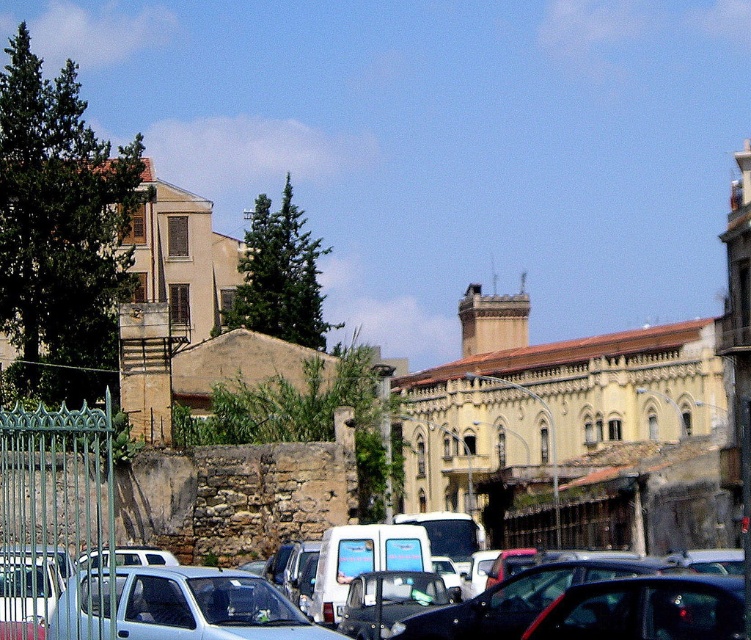
Question: Which object is closer to the camera taking this photo?

Choices:
 (A) light blue matte car at center
 (B) green wrought iron fence at left

Answer: (B)

Question: Estimate the real-world distances between objects in this image. Which object is closer to the green wrought iron fence at left?

Choices:
 (A) metallic silver car at center
 (B) light blue matte car at center

Answer: (B)

Question: Which is farther from the green wrought iron fence at left?

Choices:
 (A) metallic silver car at center
 (B) light blue matte car at center

Answer: (A)

Question: Can you confirm if metallic silver car at center is positioned below green wrought iron fence at left?

Choices:
 (A) no
 (B) yes

Answer: (B)

Question: Considering the relative positions of metallic silver car at center and green wrought iron fence at left in the image provided, where is metallic silver car at center located with respect to green wrought iron fence at left?

Choices:
 (A) below
 (B) above

Answer: (A)

Question: Is metallic silver car at center positioned behind green wrought iron fence at left?

Choices:
 (A) yes
 (B) no

Answer: (B)